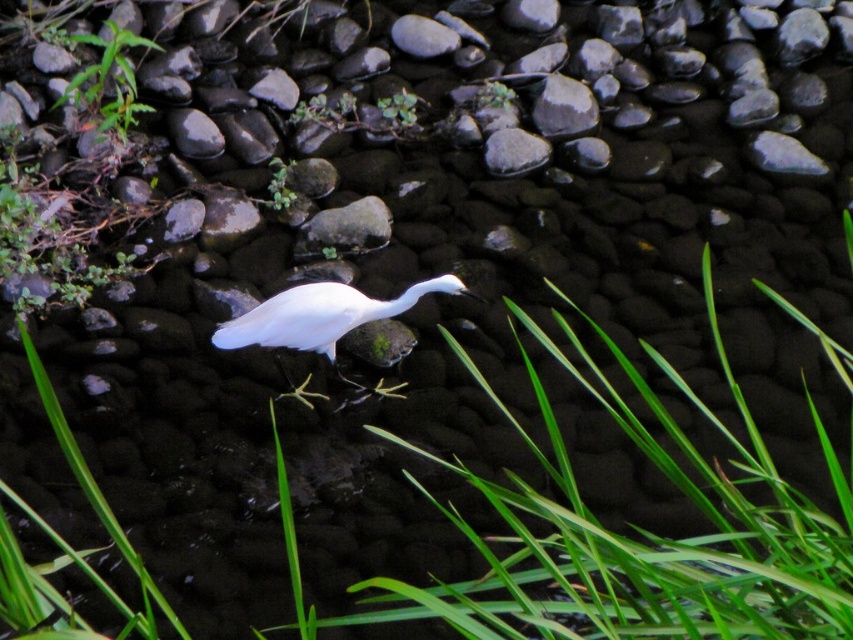
Question: Can you confirm if white matte bird at center is positioned to the right of green leafy plant at upper left?

Choices:
 (A) no
 (B) yes

Answer: (B)

Question: Which object appears farthest from the camera in this image?

Choices:
 (A) green leafy grass at center
 (B) green leafy plant at upper left
 (C) smooth gray rock at center
 (D) white matte bird at center

Answer: (B)

Question: Which of the following is the farthest from the observer?

Choices:
 (A) (282, 342)
 (B) (320, 237)
 (C) (753, 628)
 (D) (96, 77)

Answer: (D)

Question: Among these points, which one is farthest from the camera?

Choices:
 (A) (381, 227)
 (B) (91, 90)
 (C) (486, 493)

Answer: (B)

Question: Does green leafy grass at center appear under white matte bird at center?

Choices:
 (A) yes
 (B) no

Answer: (A)

Question: Is the position of white matte bird at center less distant than that of green leafy plant at upper left?

Choices:
 (A) no
 (B) yes

Answer: (B)